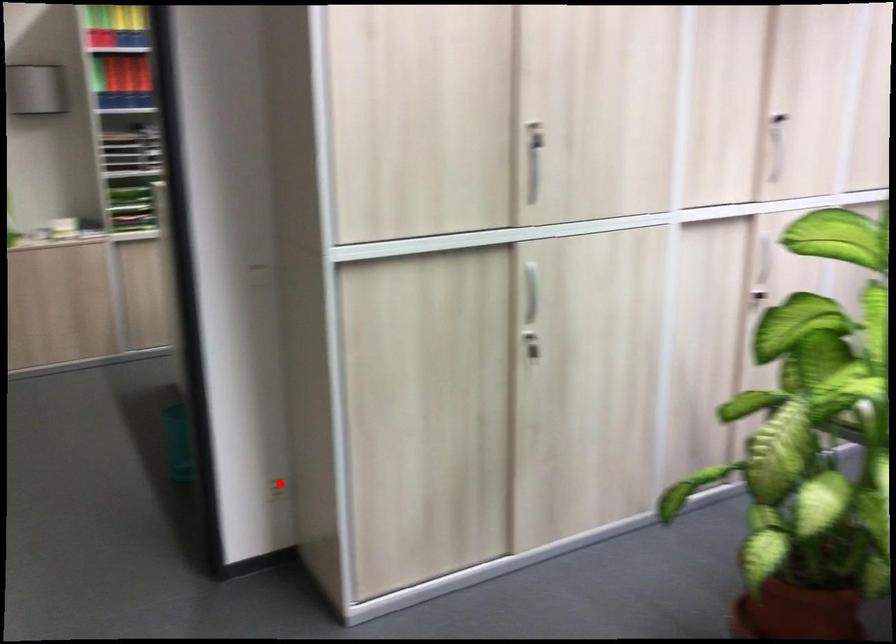
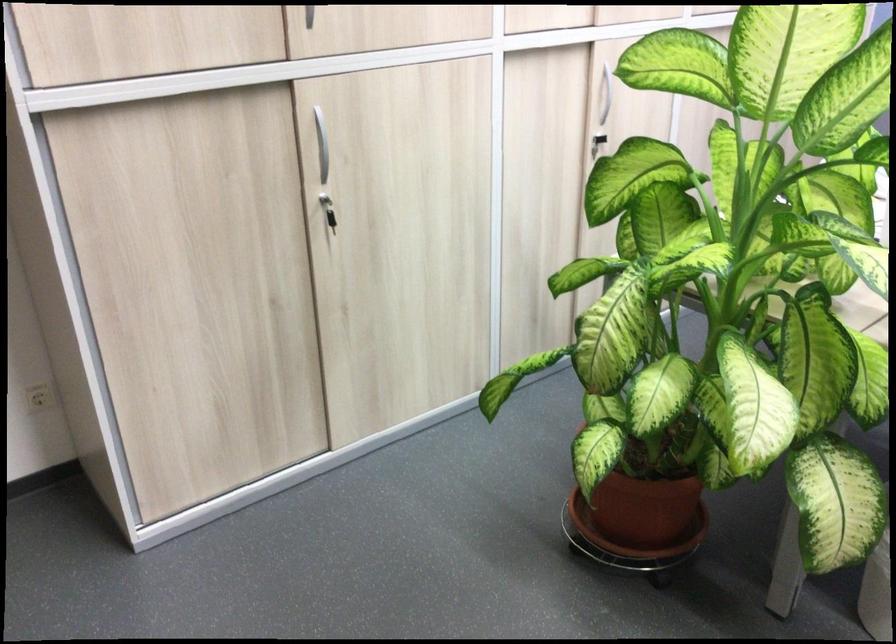
Question: A red point is marked in image1. In image2, is the corresponding 3D point closer to the camera or farther? Reply with the corresponding letter.

Choices:
 (A) The corresponding 3D point is closer.
 (B) The corresponding 3D point is farther.

Answer: (A)